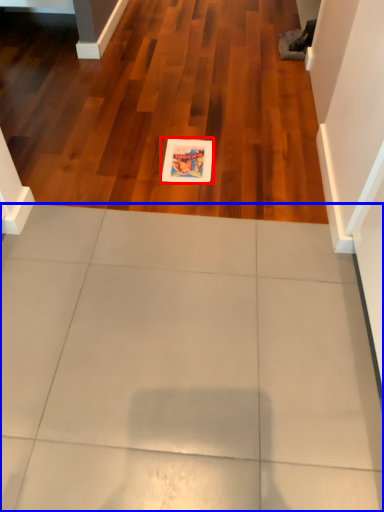
Question: Which point is further to the camera, postcard (highlighted by a red box) or ceramic tile (highlighted by a blue box)?

Choices:
 (A) postcard
 (B) ceramic tile

Answer: (A)